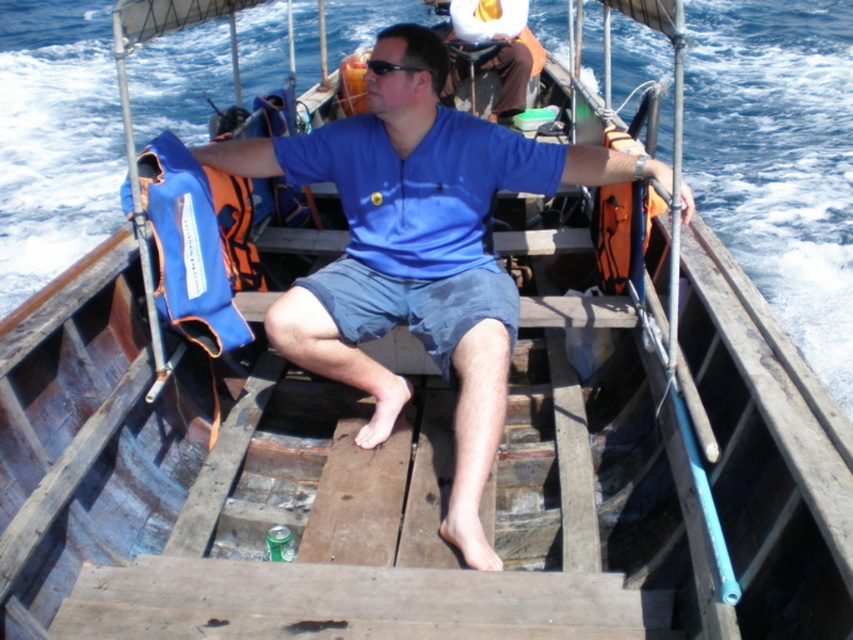
Is orange fabric life jacket at right smaller than orange fabric life jacket at left?

No, orange fabric life jacket at right is not smaller than orange fabric life jacket at left.

Between orange fabric life jacket at right and orange fabric life jacket at left, which one has more height?

Standing taller between the two is orange fabric life jacket at right.

Is point (619, 276) behind point (242, 266)?

No, (619, 276) is in front of (242, 266).

This screenshot has width=853, height=640. I want to click on orange fabric life jacket at right, so click(x=622, y=230).

Is blue fabric life jacket at left bigger than black plastic sunglasses at center?

Yes, blue fabric life jacket at left is bigger than black plastic sunglasses at center.

Can you confirm if blue fabric life jacket at left is positioned below black plastic sunglasses at center?

Yes.

Which is in front, point (165, 253) or point (368, 67)?

Positioned in front is point (165, 253).

This screenshot has width=853, height=640. I want to click on blue fabric life jacket at left, so click(x=189, y=248).

Does orange fabric life jacket at left appear over black plastic sunglasses at center?

Actually, orange fabric life jacket at left is below black plastic sunglasses at center.

Can you confirm if orange fabric life jacket at left is positioned below black plastic sunglasses at center?

Yes.

Where is `orange fabric life jacket at left`? This screenshot has width=853, height=640. orange fabric life jacket at left is located at coordinates (234, 209).